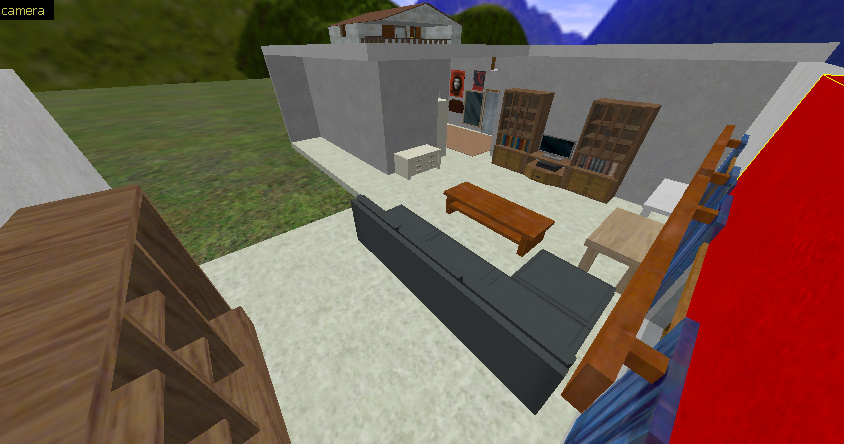
Locate an element on the screen. Image resolution: width=844 pixels, height=444 pixels. floor is located at coordinates [571, 220].